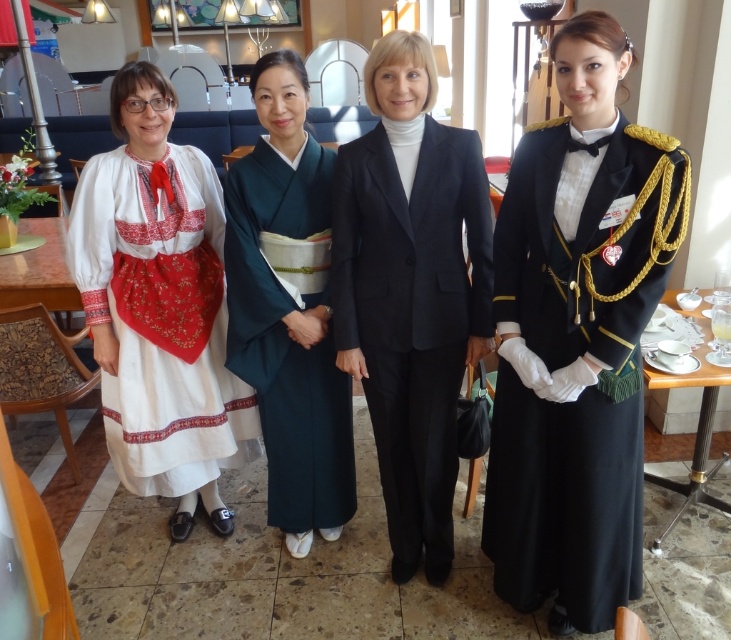
Question: Can you confirm if navy blue woolen suit at center is smaller than teal silk kimono at center?

Choices:
 (A) no
 (B) yes

Answer: (B)

Question: Based on their relative distances, which object is nearer to the navy blue woolen suit at center?

Choices:
 (A) teal silk kimono at center
 (B) shiny black uniform at right

Answer: (A)

Question: Estimate the real-world distances between objects in this image. Which object is closer to the navy blue woolen suit at center?

Choices:
 (A) white embroidered dress at left
 (B) shiny black uniform at right
 (C) teal silk kimono at center

Answer: (C)

Question: Which is nearer to the white embroidered dress at left?

Choices:
 (A) shiny black uniform at right
 (B) teal silk kimono at center

Answer: (B)

Question: Can you confirm if white embroidered dress at left is positioned to the left of navy blue woolen suit at center?

Choices:
 (A) yes
 (B) no

Answer: (A)

Question: Is shiny black uniform at right to the left of teal silk kimono at center from the viewer's perspective?

Choices:
 (A) no
 (B) yes

Answer: (A)